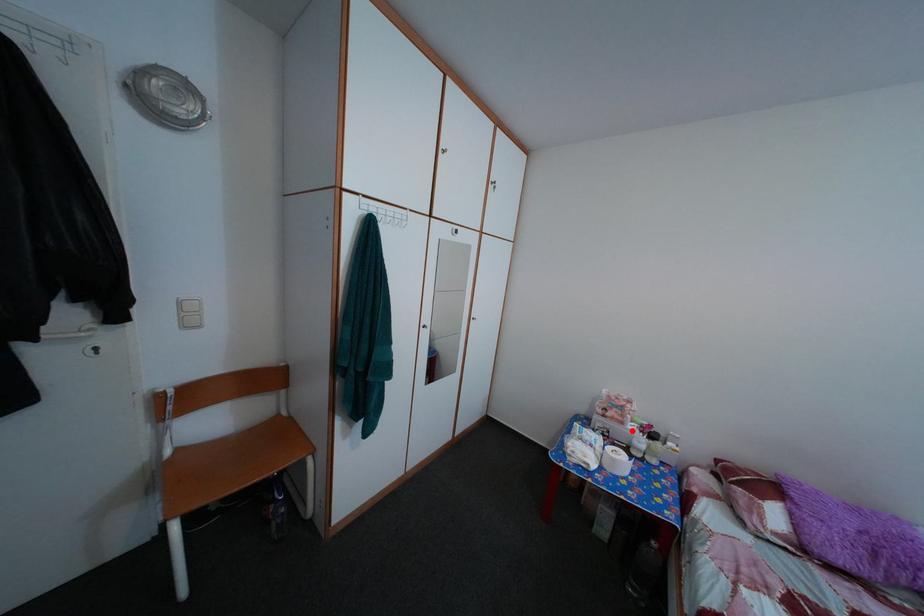
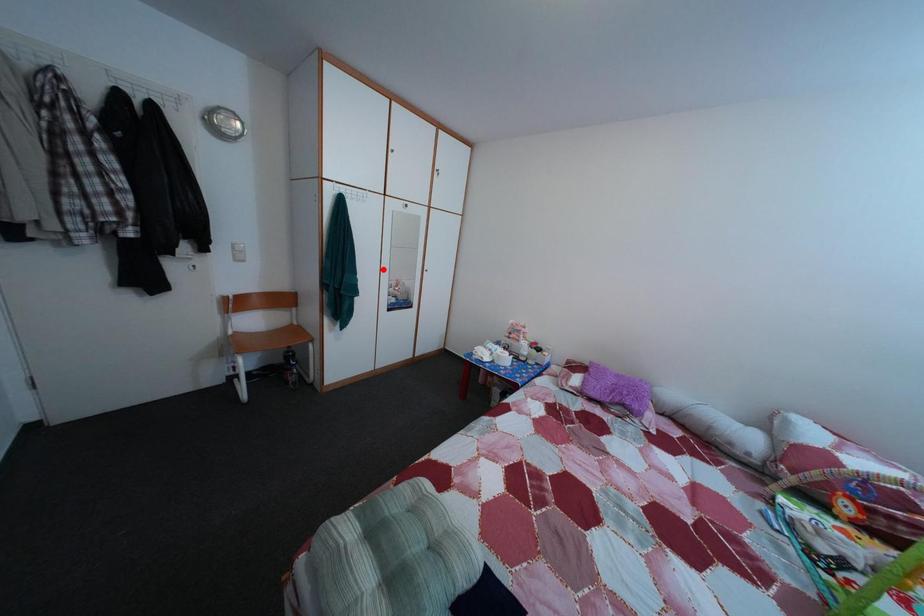
I am providing you with two images of the same scene from different viewpoints. A red point is marked on the first image and another point is marked on the second image. Are the points marked in image1 and image2 representing the same 3D position?

No